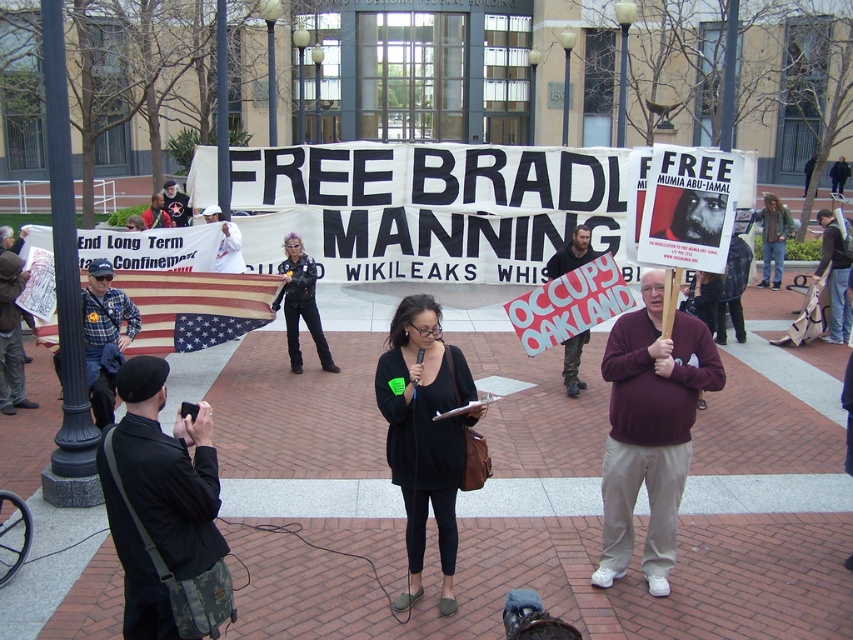
Is black matte dress at center positioned before black leather pants at center?

Yes.

Can you confirm if black matte dress at center is positioned below black leather pants at center?

Yes, black matte dress at center is below black leather pants at center.

Locate an element on the screen. black matte dress at center is located at coordinates (424, 433).